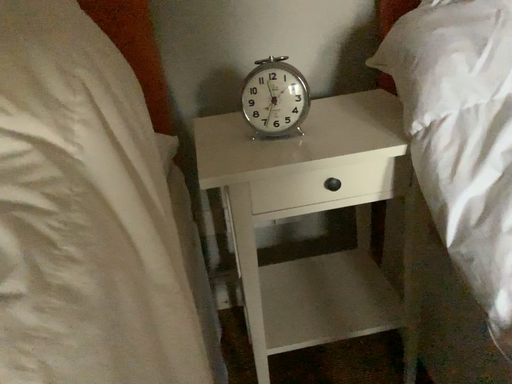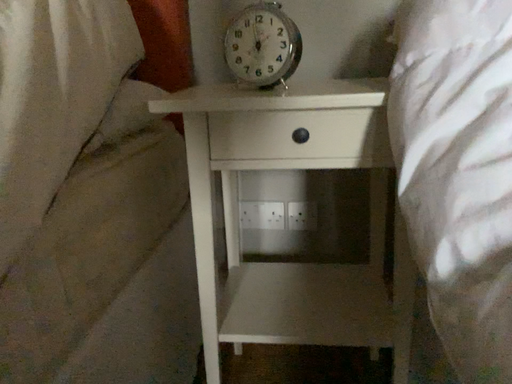
Question: How did the camera likely rotate when shooting the video?

Choices:
 (A) rotated downward
 (B) rotated upward

Answer: (B)